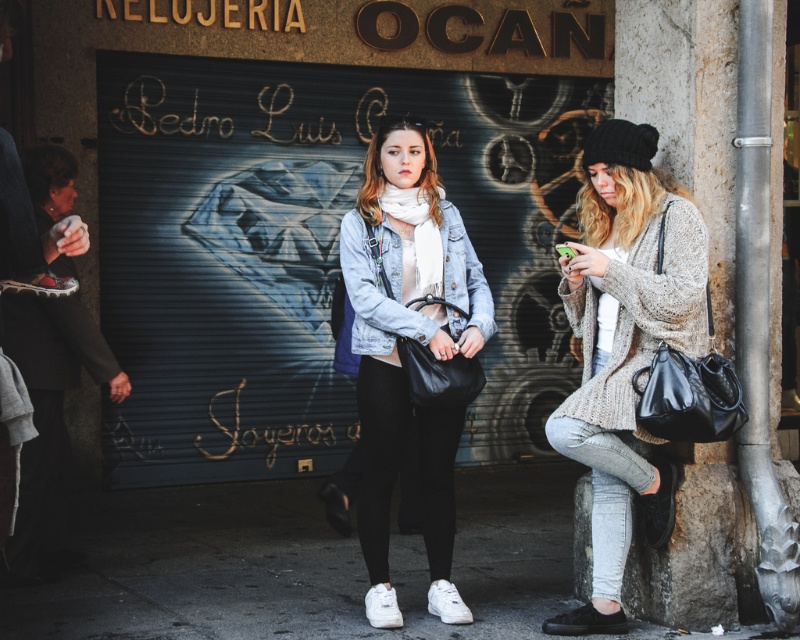
Question: Does knitted beige sweater at right have a smaller size compared to denim jacket at center?

Choices:
 (A) yes
 (B) no

Answer: (B)

Question: Where is knitted beige sweater at right located in relation to denim jacket at center in the image?

Choices:
 (A) right
 (B) left

Answer: (A)

Question: Does knitted beige sweater at right have a lesser width compared to denim jacket at center?

Choices:
 (A) no
 (B) yes

Answer: (B)

Question: Which point is closer to the camera?

Choices:
 (A) (370, 166)
 (B) (606, 349)

Answer: (B)

Question: Among these objects, which one is farthest from the camera?

Choices:
 (A) denim jacket at center
 (B) knitted beige sweater at right

Answer: (A)